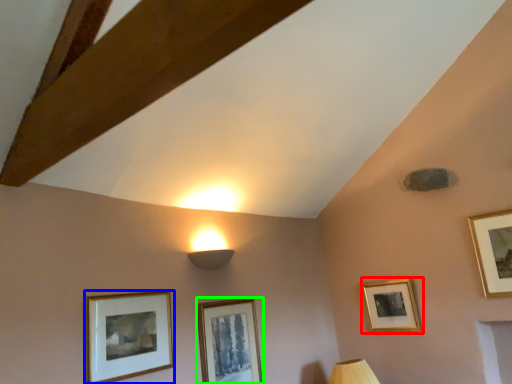
Question: Which is nearer to the picture frame (highlighted by a red box)? picture frame (highlighted by a blue box) or picture frame (highlighted by a green box).

Choices:
 (A) picture frame
 (B) picture frame

Answer: (B)